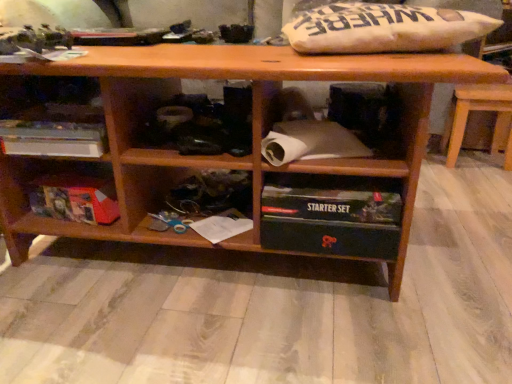
Question: From the image's perspective, would you say white cardboard box at left, the second shelf viewed from the left, is shown under black plastic starter set at lower center, which ranks as the 3th shelf in left-to-right order?

Choices:
 (A) no
 (B) yes

Answer: (A)

Question: Would you say white cardboard box at left, the second shelf viewed from the left, is outside black plastic starter set at lower center, which ranks as the 3th shelf in left-to-right order?

Choices:
 (A) yes
 (B) no

Answer: (A)

Question: Is white cardboard box at left, the second shelf viewed from the left, positioned before black plastic starter set at lower center, the 1th shelf viewed from the right?

Choices:
 (A) yes
 (B) no

Answer: (B)

Question: Does white cardboard box at left, the second shelf viewed from the left, have a lesser width compared to black plastic starter set at lower center, which ranks as the 3th shelf in left-to-right order?

Choices:
 (A) no
 (B) yes

Answer: (A)

Question: Is white cardboard box at left, placed as the second shelf when sorted from right to left, taller than black plastic starter set at lower center, which ranks as the 3th shelf in left-to-right order?

Choices:
 (A) no
 (B) yes

Answer: (A)

Question: Considering their positions, is black plastic starter set at lower center, which ranks as the 3th shelf in left-to-right order, located in front of or behind white cardboard box at left, placed as the second shelf when sorted from right to left?

Choices:
 (A) behind
 (B) front

Answer: (B)

Question: Choose the correct answer: Is black plastic starter set at lower center, which ranks as the 3th shelf in left-to-right order, inside white cardboard box at left, the second shelf viewed from the left, or outside it?

Choices:
 (A) inside
 (B) outside

Answer: (B)

Question: Based on their positions, is black plastic starter set at lower center, the 1th shelf viewed from the right, located to the left or right of white cardboard box at left, placed as the second shelf when sorted from right to left?

Choices:
 (A) left
 (B) right

Answer: (B)

Question: From the image's perspective, is black plastic starter set at lower center, the 1th shelf viewed from the right, positioned above or below white cardboard box at left, the second shelf viewed from the left?

Choices:
 (A) above
 (B) below

Answer: (B)

Question: In the image, is white cardboard box at left, the second shelf viewed from the left, positioned in front of or behind brown wooden table at right?

Choices:
 (A) behind
 (B) front

Answer: (B)

Question: Is white cardboard box at left, the second shelf viewed from the left, inside the boundaries of brown wooden table at right, or outside?

Choices:
 (A) outside
 (B) inside

Answer: (A)

Question: Based on their sizes in the image, would you say white cardboard box at left, placed as the second shelf when sorted from right to left, is bigger or smaller than brown wooden table at right?

Choices:
 (A) big
 (B) small

Answer: (B)

Question: From a real-world perspective, is white cardboard box at left, the second shelf viewed from the left, positioned above or below brown wooden table at right?

Choices:
 (A) below
 (B) above

Answer: (B)

Question: From the image's perspective, is white paper at lower center above or below brown wooden table at right?

Choices:
 (A) above
 (B) below

Answer: (B)

Question: Choose the correct answer: Is white paper at lower center inside brown wooden table at right or outside it?

Choices:
 (A) inside
 (B) outside

Answer: (B)